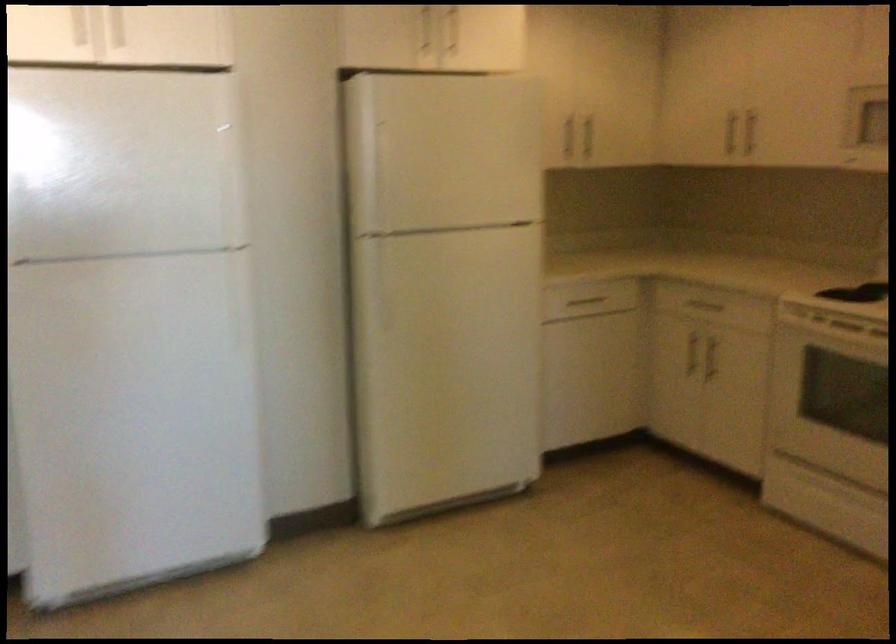
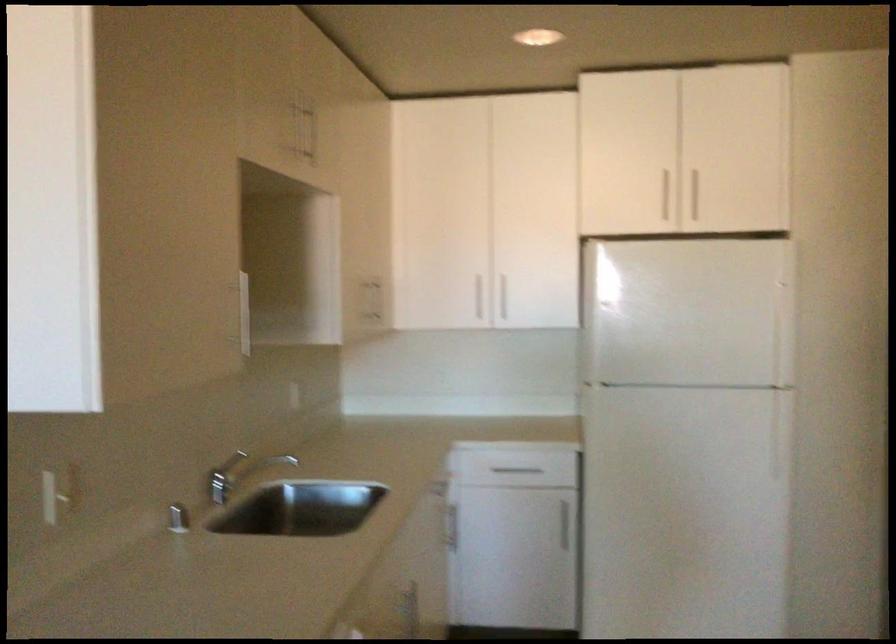
Where in the second image is the point corresponding to (136,398) from the first image?

(685, 512)